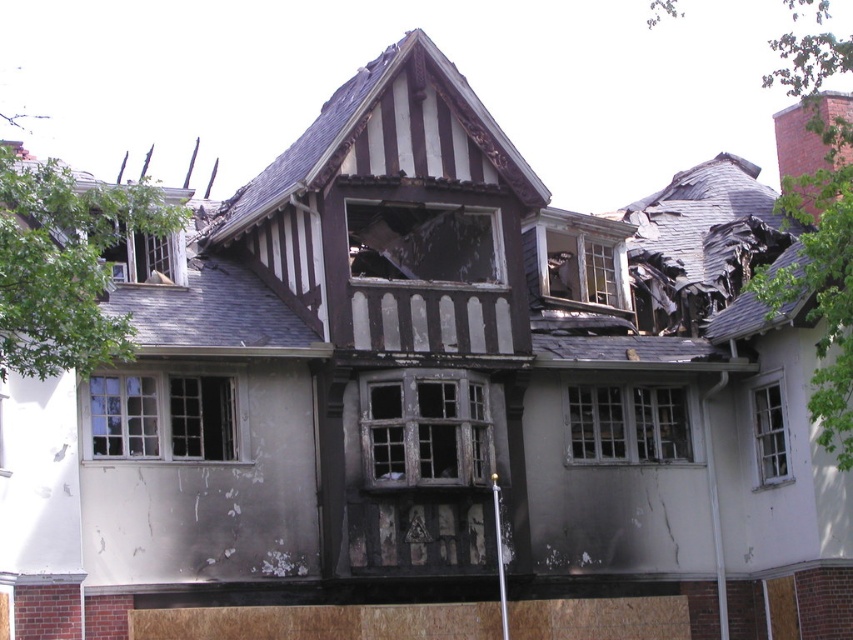
Consider the image. Who is positioned more to the right, white wooden window at lower left or charred wood window at center?

charred wood window at center is more to the right.

Can you confirm if white wooden window at lower left is positioned below charred wood window at center?

Indeed, white wooden window at lower left is positioned under charred wood window at center.

Describe the element at coordinates (161, 417) in the screenshot. This screenshot has width=853, height=640. I see `white wooden window at lower left` at that location.

Find the location of a particular element. The width and height of the screenshot is (853, 640). white wooden window at lower left is located at coordinates (161, 417).

Does white wooden window at lower left appear under transparent glass window at upper left?

Indeed, white wooden window at lower left is positioned under transparent glass window at upper left.

Identify the location of white wooden window at lower left. This screenshot has height=640, width=853. (161, 417).

Where is `white wooden window at lower left`? Image resolution: width=853 pixels, height=640 pixels. white wooden window at lower left is located at coordinates (161, 417).

Is charred wood window at center above white wooden window at lower right?

Correct, charred wood window at center is located above white wooden window at lower right.

Is point (488, 248) less distant than point (759, 445)?

Yes, point (488, 248) is in front of point (759, 445).

You are a GUI agent. You are given a task and a screenshot of the screen. Output one action in this format:
    pyautogui.click(x=<x>, y=<y>)
    Task: Click on the charred wood window at center
    
    Given the screenshot: What is the action you would take?
    pyautogui.click(x=421, y=243)

This screenshot has width=853, height=640. I want to click on charred wood window at center, so click(x=421, y=243).